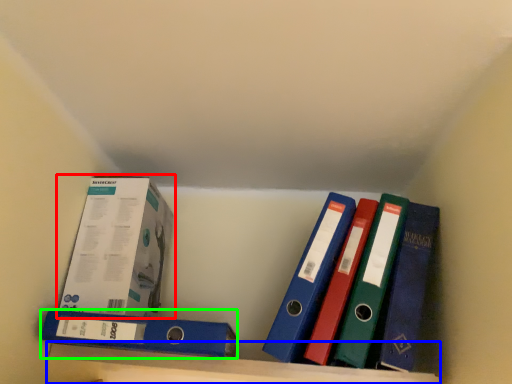
Question: Which is farther away from box (highlighted by a red box)? shelf (highlighted by a blue box) or binder (highlighted by a green box)?

Choices:
 (A) shelf
 (B) binder

Answer: (A)